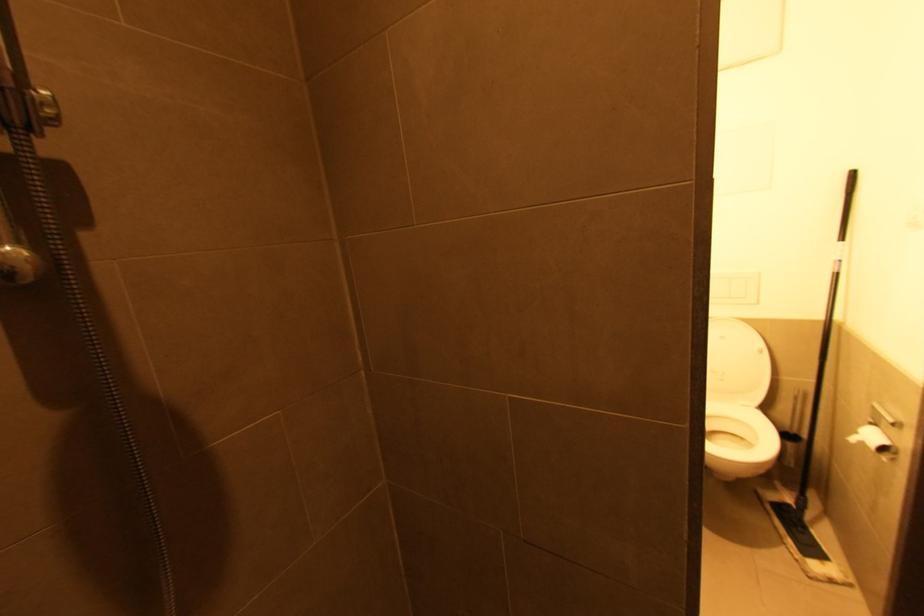
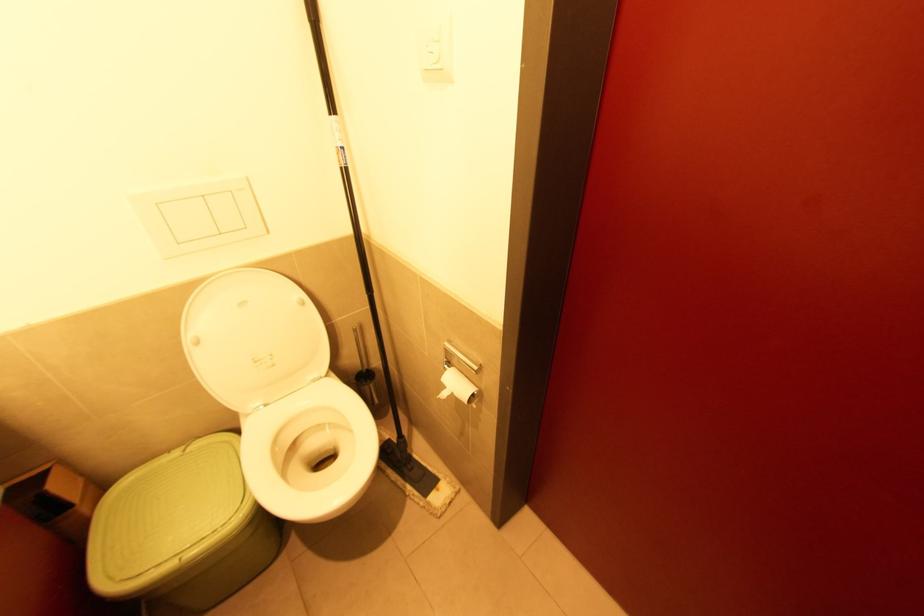
Find the pixel in the second image that matches (757,408) in the first image.

(329, 377)